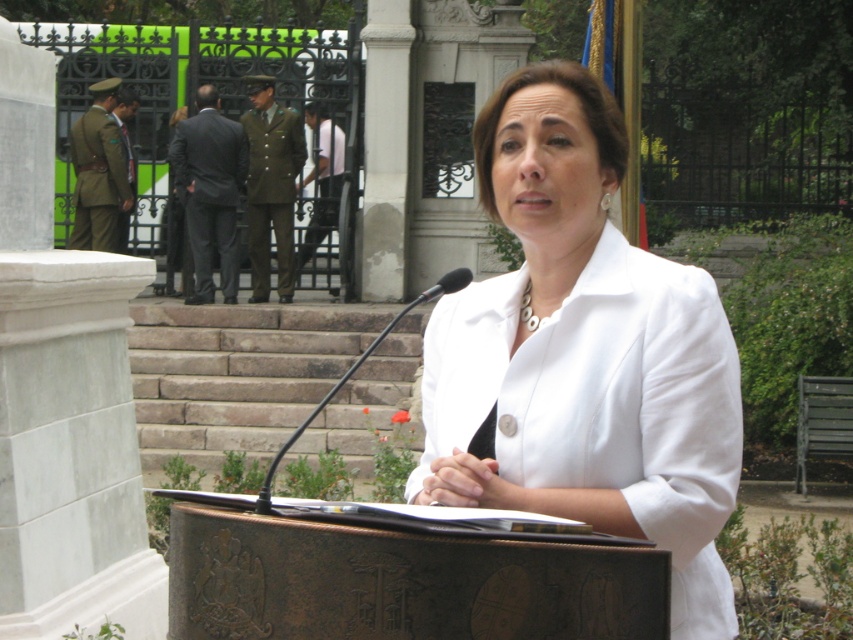
Question: Considering the relative positions of dark gray suit at center and green fabric uniform at center in the image provided, where is dark gray suit at center located with respect to green fabric uniform at center?

Choices:
 (A) above
 (B) below

Answer: (B)

Question: Which point is farther to the camera?

Choices:
 (A) (263, 284)
 (B) (97, 218)

Answer: (B)

Question: Based on their relative distances, which object is nearer to the green fabric uniform at left?

Choices:
 (A) dark gray suit at center
 (B) white matte jacket at center

Answer: (A)

Question: Which object is closer to the camera taking this photo?

Choices:
 (A) green fabric uniform at left
 (B) green fabric uniform at center

Answer: (B)

Question: Is white matte jacket at center bigger than green fabric uniform at center?

Choices:
 (A) no
 (B) yes

Answer: (A)

Question: Does dark gray suit at center have a lesser width compared to green fabric uniform at center?

Choices:
 (A) no
 (B) yes

Answer: (A)